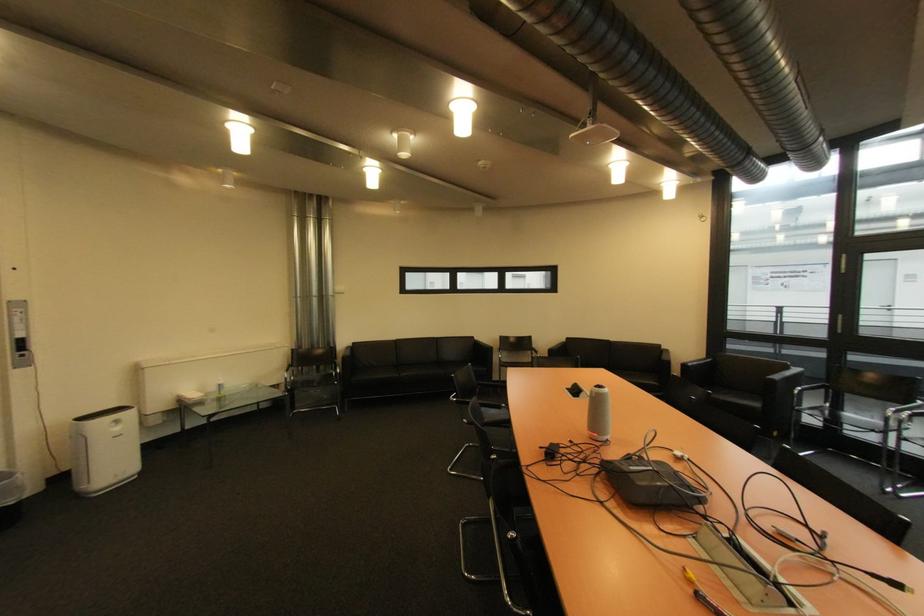
You are a GUI agent. You are given a task and a screenshot of the screen. Output one action in this format:
    pyautogui.click(x=<x>, y=<y>)
    Task: Click on the wall panel button
    The width and height of the screenshot is (924, 616).
    Given the screenshot: What is the action you would take?
    pyautogui.click(x=21, y=342)